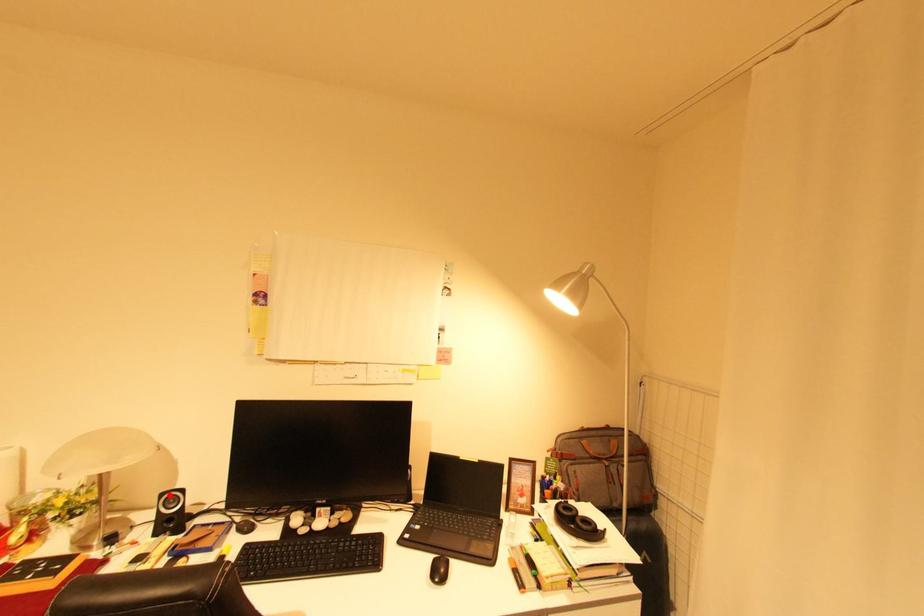
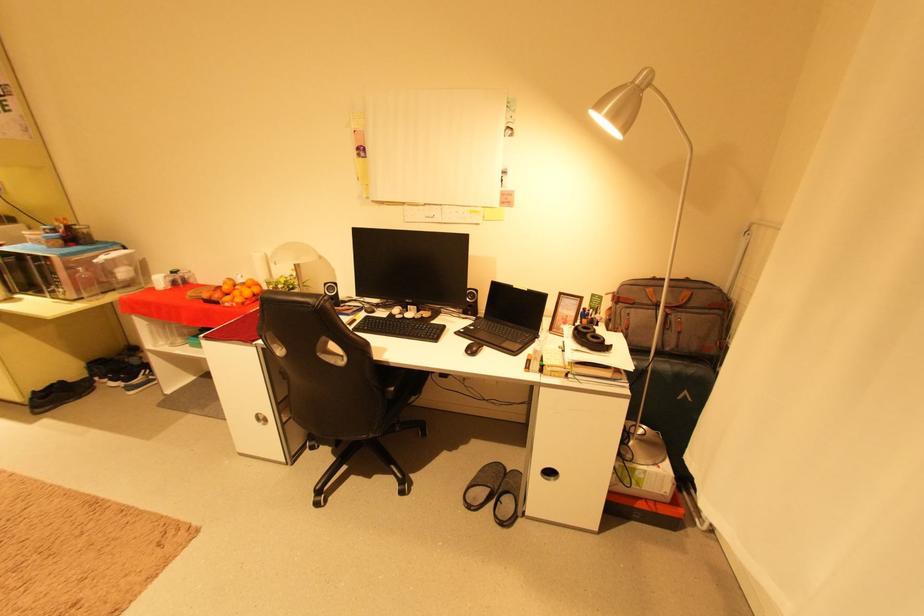
Locate, in the second image, the point that corresponds to the highlighted location in the first image.

(333, 285)